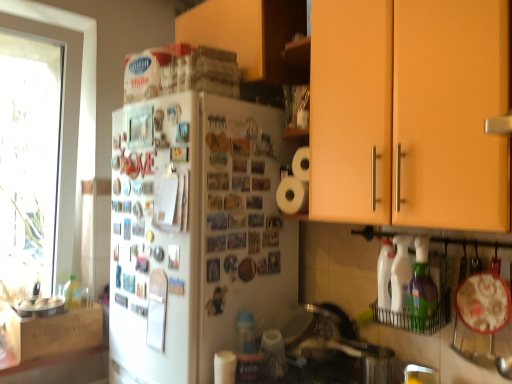
Question: Is wooden crate at left, the third cabinetry viewed from the right, taller or shorter than white plastic spray bottle at lower right, the 1th bottle in the back-to-front sequence?

Choices:
 (A) short
 (B) tall

Answer: (A)

Question: Is wooden crate at left, acting as the third cabinetry starting from the top, wider or thinner than white plastic spray bottle at lower right, the 1th bottle in the back-to-front sequence?

Choices:
 (A) wide
 (B) thin

Answer: (A)

Question: Which object is positioned farthest from the wooden cabinet at upper center, acting as the third cabinetry starting from the bottom?

Choices:
 (A) green plastic bottle at lower right, which is the second bottle in back-to-front order
 (B) white matte paper towel at lower center
 (C) matte orange cabinet at upper right, the third cabinetry positioned from the left
 (D) white plastic spray bottle at lower right, the 1th bottle in the back-to-front sequence
 (E) wooden crate at left, the third cabinetry viewed from the right

Answer: (E)

Question: Which of these objects is positioned closest to the green plastic bottle at lower right, which is the second bottle in back-to-front order?

Choices:
 (A) white plastic spray bottle at lower right, the 1th bottle in the back-to-front sequence
 (B) matte orange cabinet at upper right, the first cabinetry from the right
 (C) wooden crate at left, acting as the third cabinetry starting from the top
 (D) white matte paper towel at lower center
 (E) white matte refrigerator at center

Answer: (A)